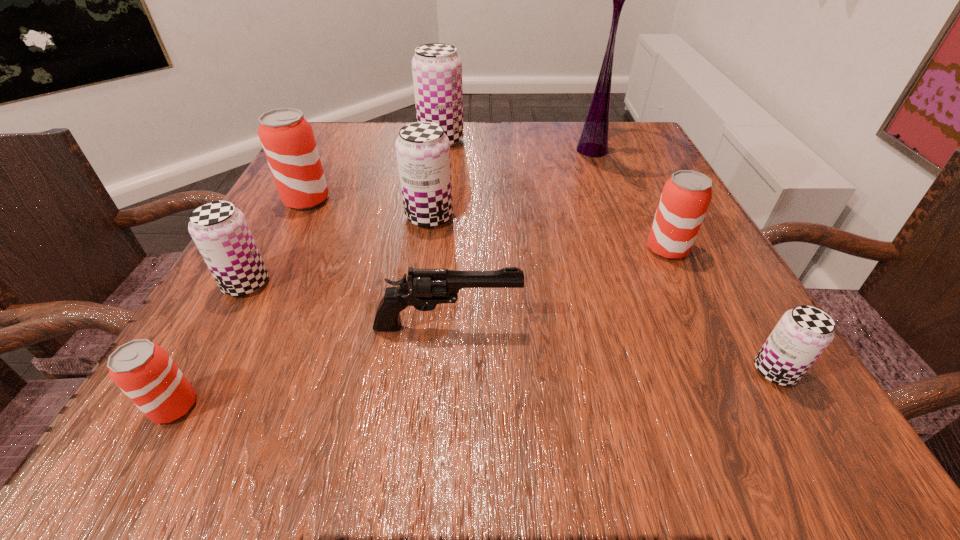
The image size is (960, 540). Identify the location of vacant region between the farthest purple beer can and the nearest orange beer can. (308, 273).

I want to click on vacant area that lies between the black gun and the third biggest purple beer can, so (x=347, y=305).

Locate an element on the screen. The height and width of the screenshot is (540, 960). vacant space in between the farthest orange beer can and the third nearest object is located at coordinates (376, 263).

At what (x,y) coordinates should I click in order to perform the action: click on vacant space in between the gun and the rightmost purple beer can. Please return your answer as a coordinate pair (x, y). The width and height of the screenshot is (960, 540). Looking at the image, I should click on (611, 348).

Where is `free space between the black gun and the eighth shortest object`? This screenshot has height=540, width=960. free space between the black gun and the eighth shortest object is located at coordinates (444, 233).

Identify the location of object that is the fifth closest to the rightmost purple beer can. The height and width of the screenshot is (540, 960). (220, 231).

Identify which object is the fourth closest to the rightmost purple beer can. Please provide its 2D coordinates. Your answer should be formatted as a tuple, i.e. [(x, y)], where the tuple contains the x and y coordinates of a point satisfying the conditions above.

[(423, 149)]

Where is `beer can that is the sixth closest one to the gun`? beer can that is the sixth closest one to the gun is located at coordinates (287, 139).

At what (x,y) coordinates should I click in order to perform the action: click on the fifth closest beer can relative to the second smallest purple beer can. Please return your answer as a coordinate pair (x, y). The height and width of the screenshot is (540, 960). Looking at the image, I should click on (685, 198).

This screenshot has width=960, height=540. In order to click on the closest purple beer can to the nearest orange beer can in this screenshot , I will do `click(220, 231)`.